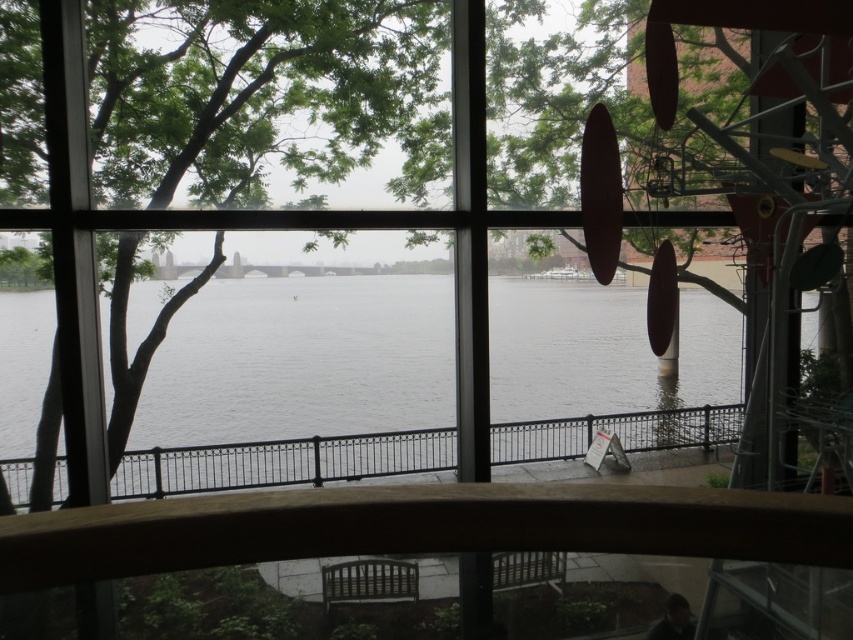
Does gray water at center appear over black metal railing at center?

Correct, gray water at center is located above black metal railing at center.

Does point (537, 448) lie in front of point (589, 422)?

Yes, point (537, 448) is in front of point (589, 422).

Locate an element on the screen. The height and width of the screenshot is (640, 853). gray water at center is located at coordinates (299, 388).